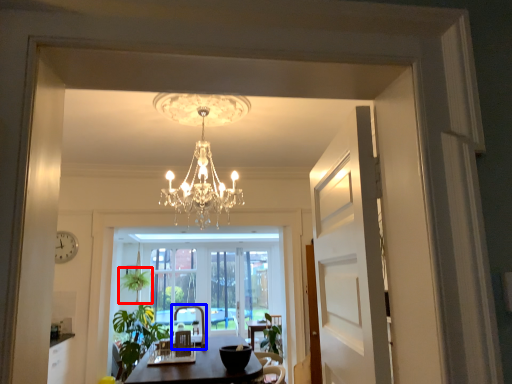
Question: Among these objects, which one is farthest to the camera, plant (highlighted by a red box) or armchair (highlighted by a blue box)?

Choices:
 (A) plant
 (B) armchair

Answer: (A)